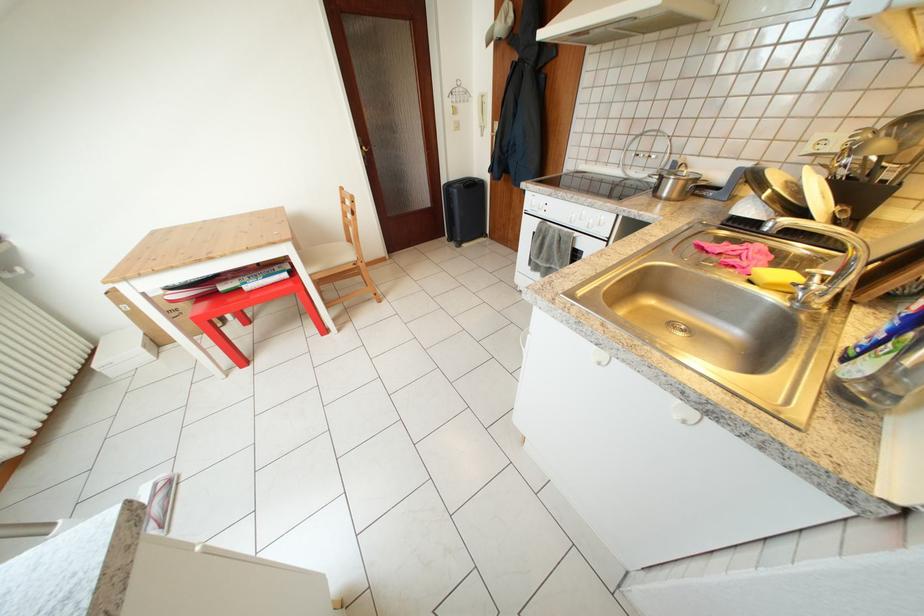
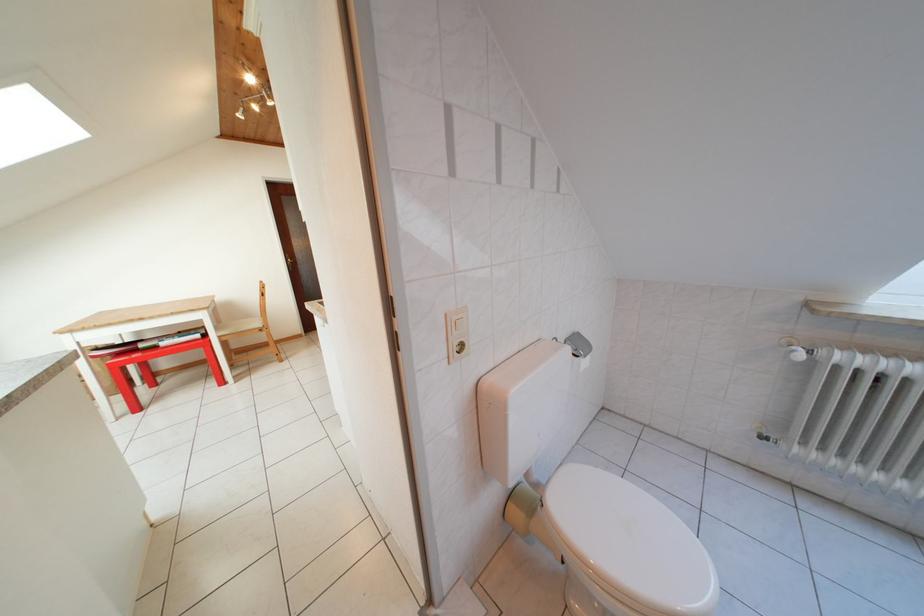
In a continuous first-person perspective shot, in which direction is the camera moving?

The cameraman walked toward right, backward.